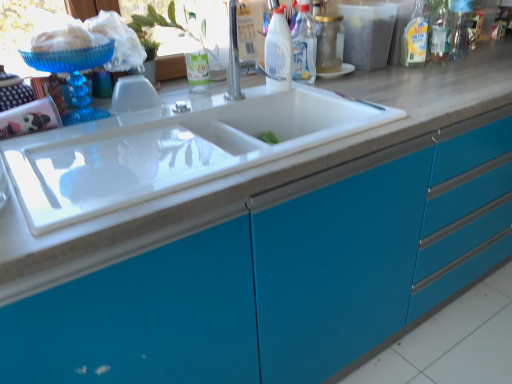
Identify the location of vacant space to the left of silver metallic faucet at upper center. 198,106.